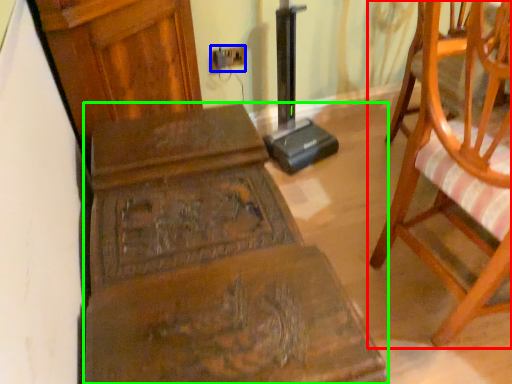
Question: Estimate the real-world distances between objects in this image. Which object is closer to chair (highlighted by a red box), electric outlet (highlighted by a blue box) or furniture (highlighted by a green box)?

Choices:
 (A) electric outlet
 (B) furniture

Answer: (B)